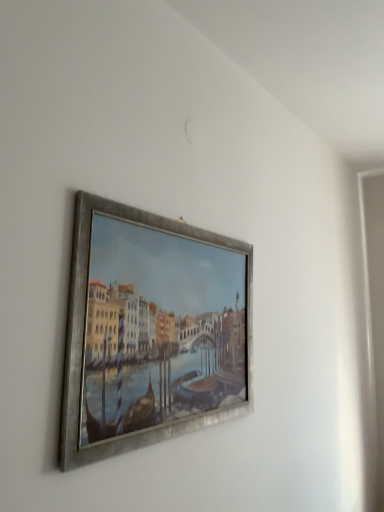
The image size is (384, 512). What do you see at coordinates (151, 331) in the screenshot?
I see `silver metallic frame at upper center` at bounding box center [151, 331].

Where is `silver metallic frame at upper center`? The width and height of the screenshot is (384, 512). silver metallic frame at upper center is located at coordinates (151, 331).

The width and height of the screenshot is (384, 512). I want to click on silver metallic frame at upper center, so [151, 331].